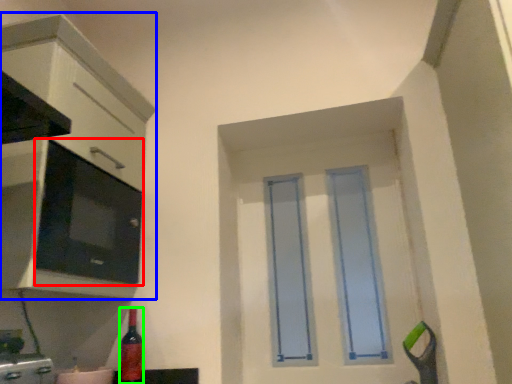
Question: Considering the real-world distances, which object is closest to appliance (highlighted by a red box)? cabinetry (highlighted by a blue box) or bottle (highlighted by a green box).

Choices:
 (A) cabinetry
 (B) bottle

Answer: (A)